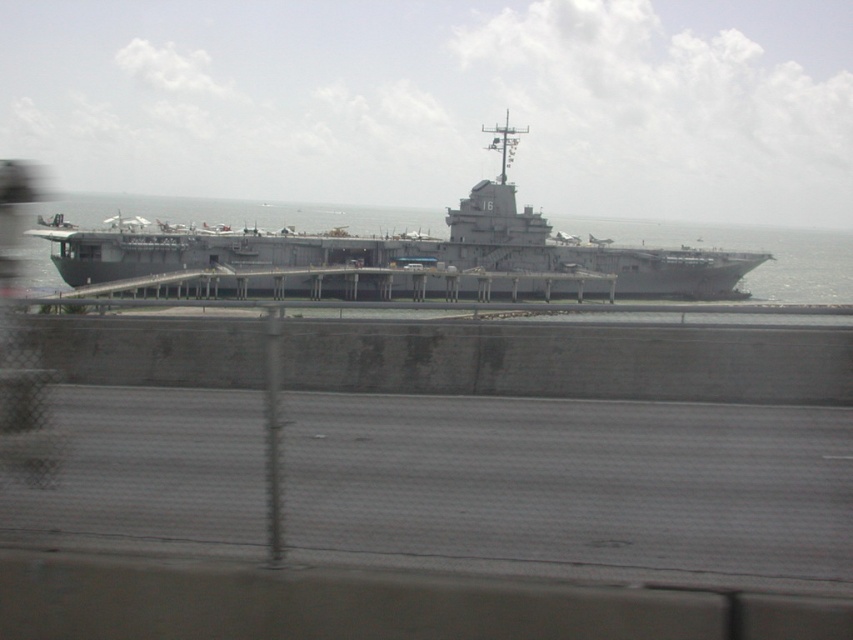
Question: Which of the following is the farthest from the observer?

Choices:
 (A) (633, 224)
 (B) (398, 262)

Answer: (A)

Question: Can you confirm if gray metallic warship at center is smaller than gray metallic water at center?

Choices:
 (A) yes
 (B) no

Answer: (A)

Question: Does gray metallic warship at center come behind gray metallic water at center?

Choices:
 (A) no
 (B) yes

Answer: (B)

Question: In this image, where is gray metallic warship at center located relative to gray metallic water at center?

Choices:
 (A) below
 (B) above

Answer: (A)